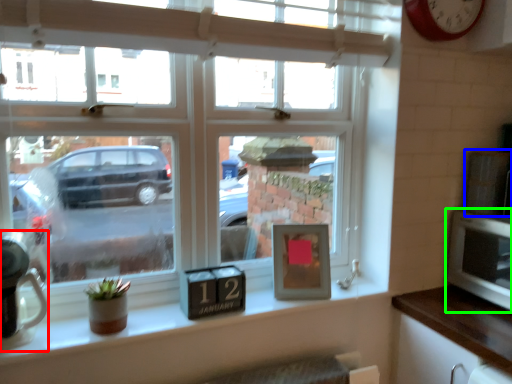
Question: Which is farther away from appliance (highlighted by a red box)? appliance (highlighted by a blue box) or microwave (highlighted by a green box)?

Choices:
 (A) appliance
 (B) microwave

Answer: (A)